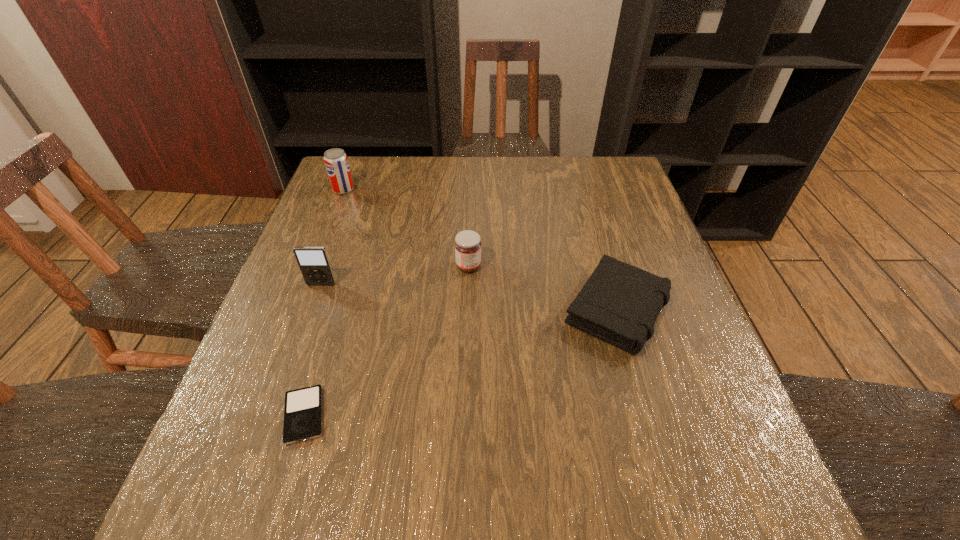
At what (x,y) coordinates should I click in order to perform the action: click on soda. Please return your answer as a coordinate pair (x, y). Looking at the image, I should click on (336, 162).

Where is `the farther iPod`? the farther iPod is located at coordinates (313, 261).

The height and width of the screenshot is (540, 960). I want to click on the third tallest object, so click(467, 244).

Find the location of `the fourth object from left to right`. the fourth object from left to right is located at coordinates (467, 244).

You are a GUI agent. You are given a task and a screenshot of the screen. Output one action in this format:
    pyautogui.click(x=<x>, y=<y>)
    Task: Click on the rightmost object
    
    Given the screenshot: What is the action you would take?
    pyautogui.click(x=619, y=303)

Locate an element on the screen. Image resolution: width=960 pixels, height=540 pixels. the fourth tallest object is located at coordinates tap(619, 303).

At what (x,y) coordinates should I click in order to perform the action: click on the shortest object. Please return your answer as a coordinate pair (x, y). This screenshot has width=960, height=540. Looking at the image, I should click on (303, 407).

Find the location of `the nearer iPod`. the nearer iPod is located at coordinates pos(303,407).

Locate an element on the screen. The width and height of the screenshot is (960, 540). blank space located on the right of the soda is located at coordinates (381, 190).

Where is `vacant position located on the front-facing side of the farther iPod`? vacant position located on the front-facing side of the farther iPod is located at coordinates (315, 302).